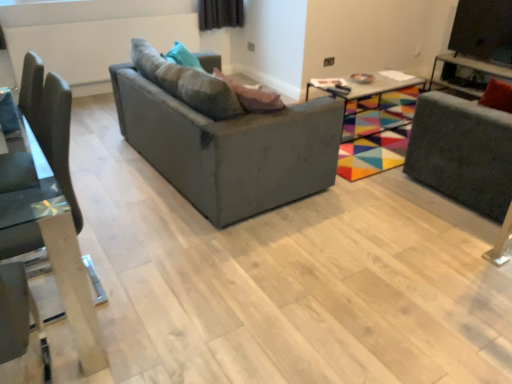
Question: Does black glossy tv at upper right have a larger size compared to multicolored fabric table at center, marked as the 1th table in a left-to-right arrangement?

Choices:
 (A) yes
 (B) no

Answer: (B)

Question: Is multicolored fabric table at center, marked as the 1th table in a left-to-right arrangement, surrounded by black glossy tv at upper right?

Choices:
 (A) yes
 (B) no

Answer: (B)

Question: Would you consider black glossy tv at upper right to be distant from multicolored fabric table at center, placed as the second table when sorted from right to left?

Choices:
 (A) no
 (B) yes

Answer: (B)

Question: From a real-world perspective, does black glossy tv at upper right stand above multicolored fabric table at center, placed as the second table when sorted from right to left?

Choices:
 (A) yes
 (B) no

Answer: (A)

Question: From a real-world perspective, is black glossy tv at upper right below multicolored fabric table at center, marked as the 1th table in a left-to-right arrangement?

Choices:
 (A) yes
 (B) no

Answer: (B)

Question: Is black glossy tv at upper right directly adjacent to multicolored fabric table at center, marked as the 1th table in a left-to-right arrangement?

Choices:
 (A) yes
 (B) no

Answer: (B)

Question: Is velvet grey swivel chair at right outside of black glossy tv at upper right?

Choices:
 (A) no
 (B) yes

Answer: (B)

Question: From a real-world perspective, is velvet grey swivel chair at right physically below black glossy tv at upper right?

Choices:
 (A) yes
 (B) no

Answer: (A)

Question: From a real-world perspective, is velvet grey swivel chair at right on black glossy tv at upper right?

Choices:
 (A) no
 (B) yes

Answer: (A)

Question: Considering the relative sizes of velvet grey swivel chair at right and black glossy tv at upper right in the image provided, is velvet grey swivel chair at right smaller than black glossy tv at upper right?

Choices:
 (A) no
 (B) yes

Answer: (A)

Question: Does velvet grey swivel chair at right appear on the right side of black glossy tv at upper right?

Choices:
 (A) no
 (B) yes

Answer: (A)

Question: Considering the relative positions of velvet grey swivel chair at right and black glossy tv at upper right in the image provided, is velvet grey swivel chair at right to the left of black glossy tv at upper right from the viewer's perspective?

Choices:
 (A) no
 (B) yes

Answer: (B)

Question: Does matte gray couch at center turn towards velvet grey swivel chair at right?

Choices:
 (A) no
 (B) yes

Answer: (B)